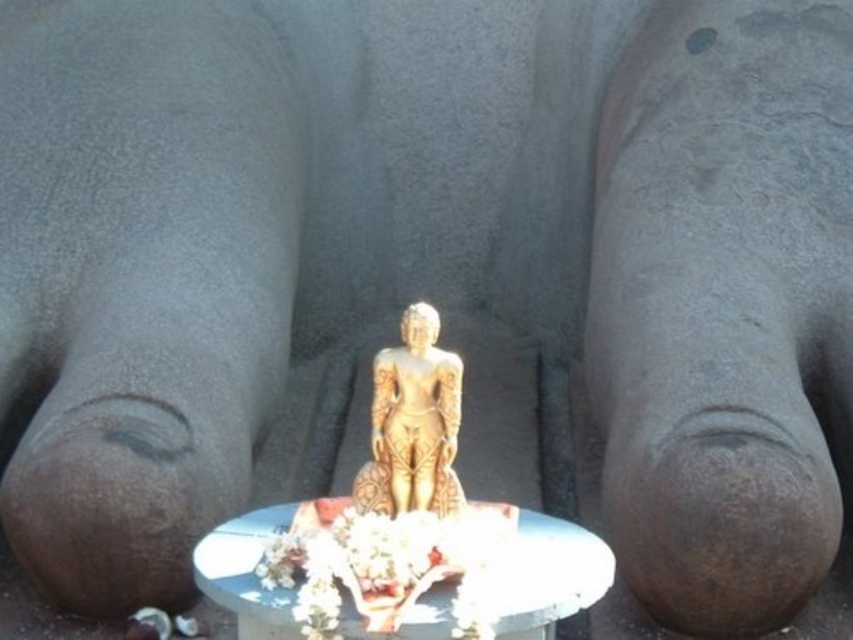
Is white glossy table at center to the left of gold polished statue at center from the viewer's perspective?

Yes, white glossy table at center is to the left of gold polished statue at center.

Which is more to the right, white glossy table at center or gold polished statue at center?

gold polished statue at center

Between point (576, 604) and point (405, 324), which one is positioned in front?

Point (576, 604) is in front.

At what (x,y) coordinates should I click in order to perform the action: click on white glossy table at center. Please return your answer as a coordinate pair (x, y). Looking at the image, I should click on (550, 572).